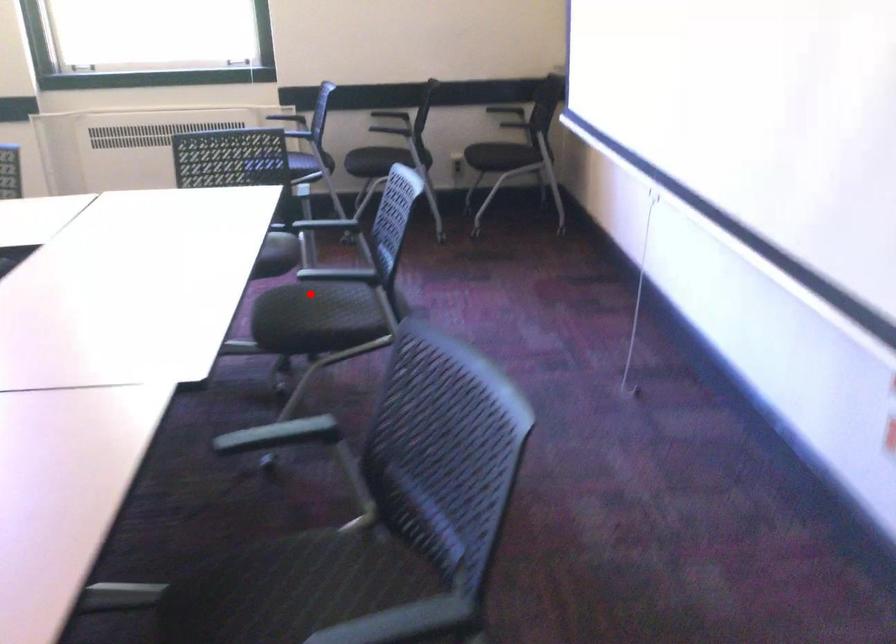
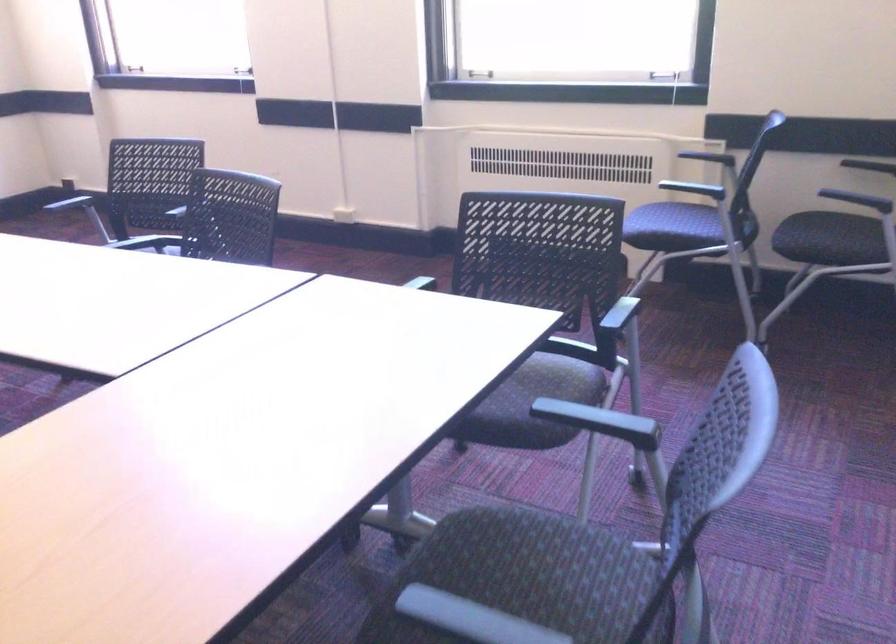
Question: I am providing you with two images of the same scene from different viewpoints. A red point is shown in image1. For the corresponding object point in image2, is it positioned nearer or farther from the camera?

Choices:
 (A) Nearer
 (B) Farther

Answer: (A)